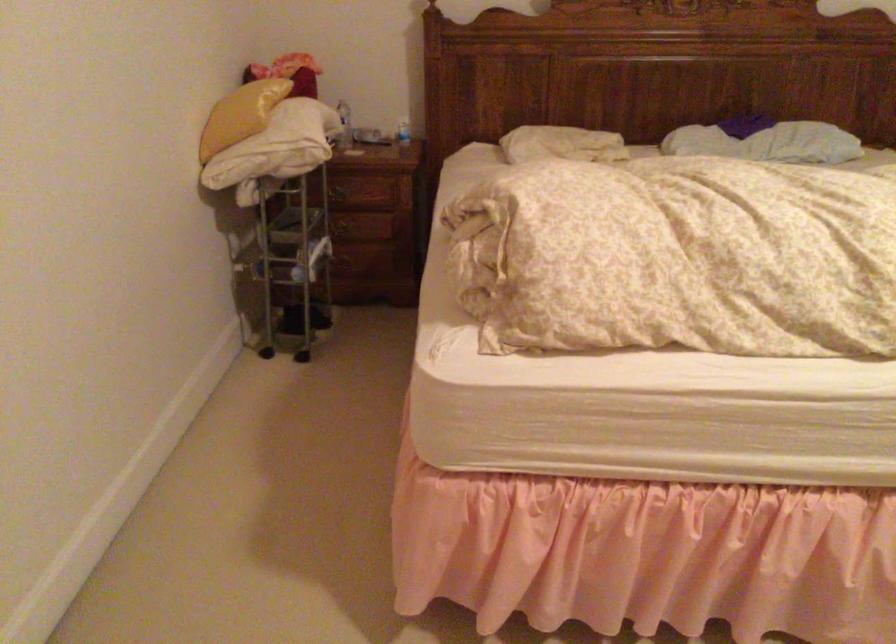
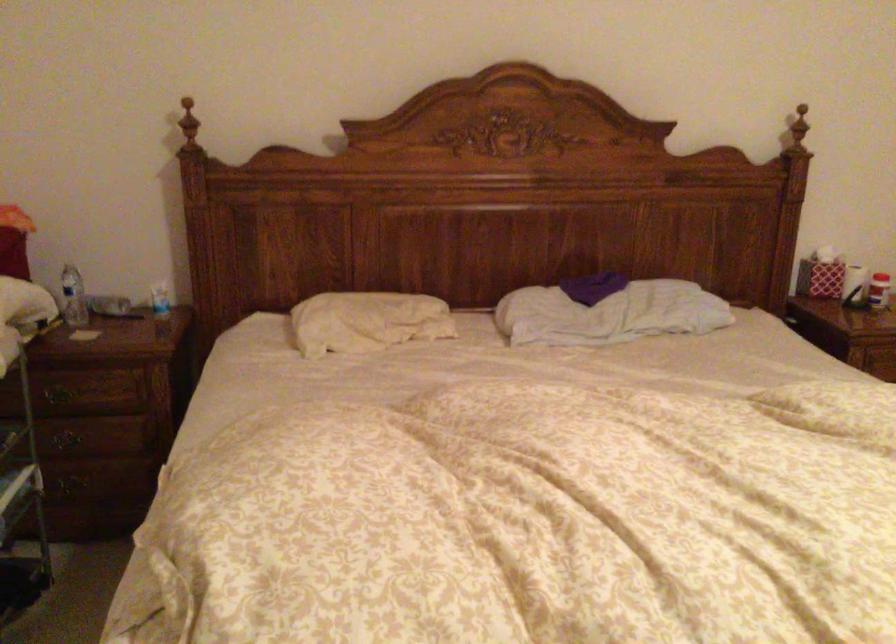
Question: In a continuous first-person perspective shot, in which direction is the camera moving?

Choices:
 (A) Left
 (B) Right
 (C) Forward
 (D) Backward

Answer: (C)